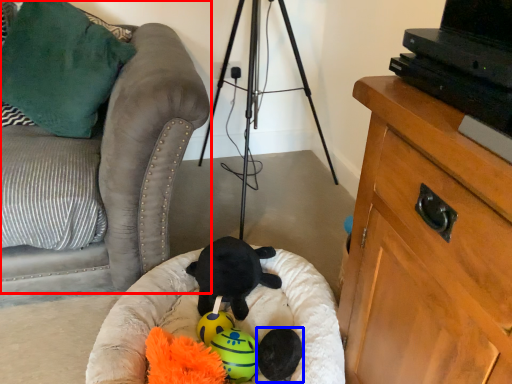
Question: Which object is further to the camera taking this photo, furniture (highlighted by a red box) or toy (highlighted by a blue box)?

Choices:
 (A) furniture
 (B) toy

Answer: (B)